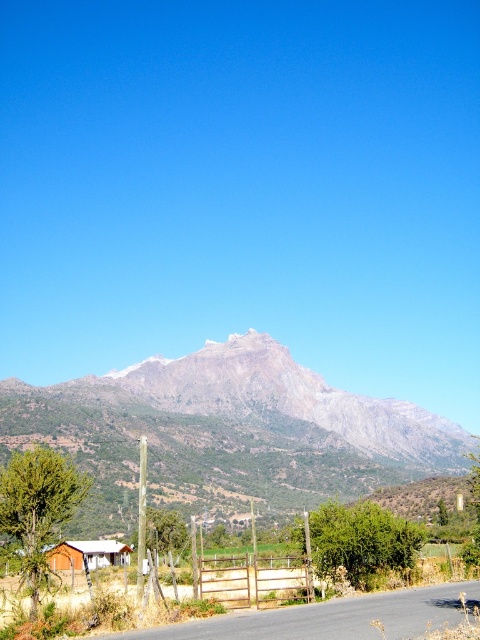
Is the position of gray rocky mountain range at upper center more distant than that of wooden cabin at lower left?

Yes, it is behind wooden cabin at lower left.

Who is more distant from viewer, (254, 413) or (49, 552)?

Point (254, 413)

The height and width of the screenshot is (640, 480). I want to click on gray rocky mountain range at upper center, so click(227, 433).